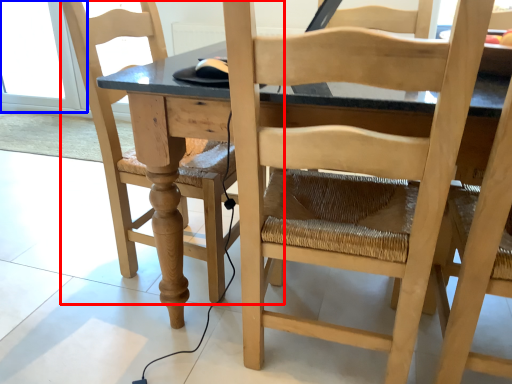
Question: Among these objects, which one is nearest to the camera, chair (highlighted by a red box) or glass door (highlighted by a blue box)?

Choices:
 (A) chair
 (B) glass door

Answer: (A)